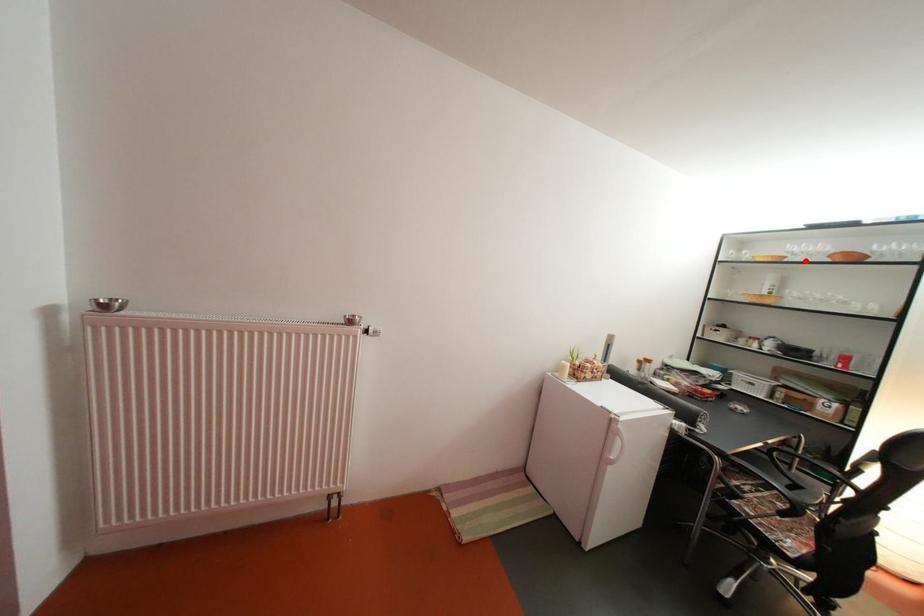
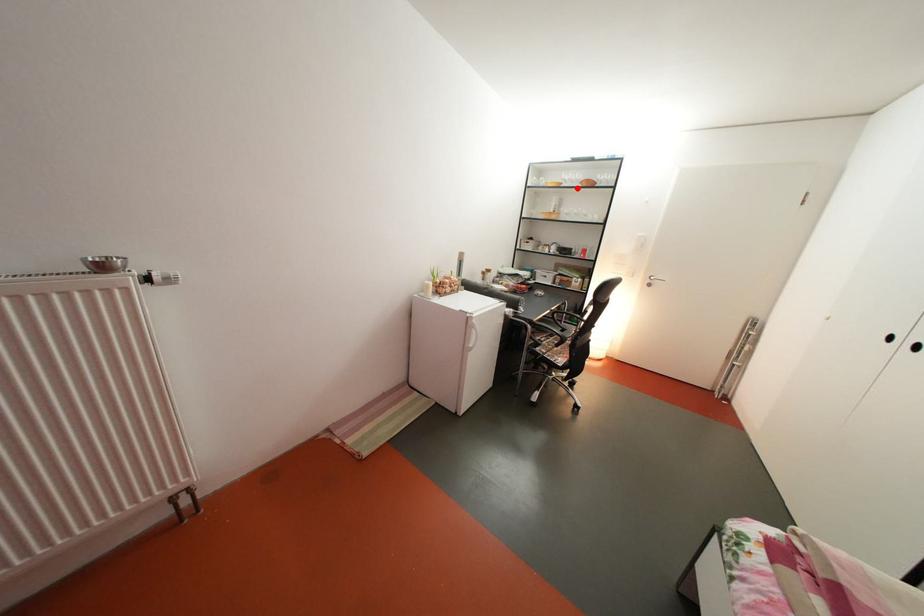
I am providing you with two images of the same scene from different viewpoints. A red point is marked on the first image and another point is marked on the second image. Are the points marked in image1 and image2 representing the same 3D position?

Yes